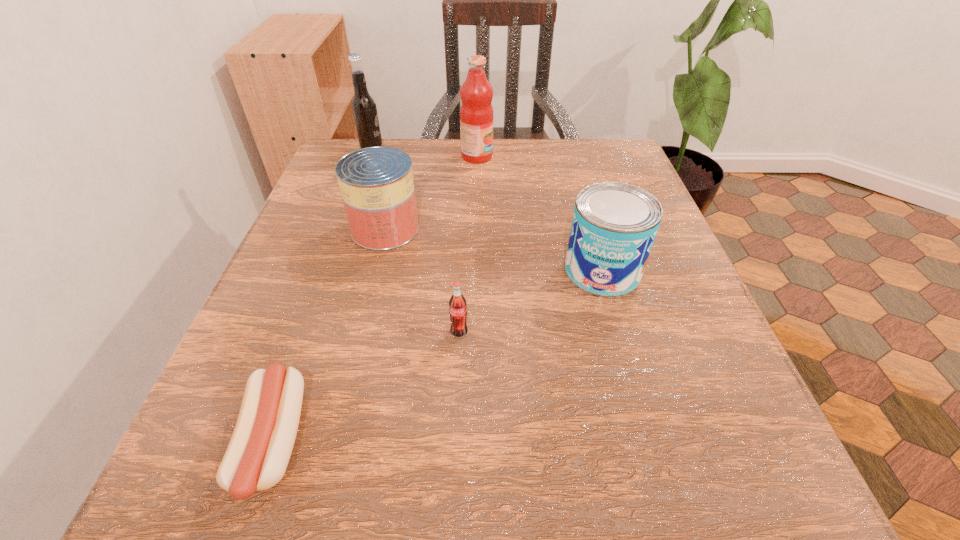
Image resolution: width=960 pixels, height=540 pixels. I want to click on free space that is in between the fruit juice and the left can, so click(431, 193).

Locate an element on the screen. This screenshot has height=540, width=960. unoccupied position between the fruit juice and the root beer is located at coordinates (424, 154).

The width and height of the screenshot is (960, 540). What are the coordinates of `blank region between the left can and the fruit juice` in the screenshot? It's located at tap(431, 193).

In order to click on vacant space in between the fruit juice and the right can in this screenshot , I will do pyautogui.click(x=540, y=214).

The width and height of the screenshot is (960, 540). Find the location of `vacant region between the fruit juice and the left can`. vacant region between the fruit juice and the left can is located at coordinates (431, 193).

Locate an element on the screen. The image size is (960, 540). blank region between the fifth tallest object and the sausage is located at coordinates (366, 387).

This screenshot has width=960, height=540. Find the location of `object that stands as the closest to the root beer`. object that stands as the closest to the root beer is located at coordinates (476, 113).

Image resolution: width=960 pixels, height=540 pixels. I want to click on object that is the fourth closest to the soda bottle, so click(476, 113).

Locate an element on the screen. Image resolution: width=960 pixels, height=540 pixels. free space that satisfies the following two spatial constraints: 1. on the label of the root beer; 2. on the right side of the shortest object is located at coordinates (267, 442).